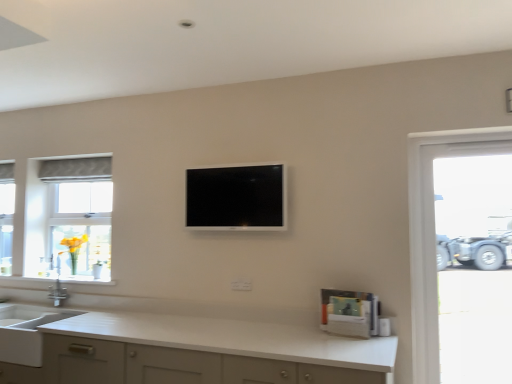
Question: From a real-world perspective, is yellow glass vase at left physically above silver metallic faucet at left?

Choices:
 (A) yes
 (B) no

Answer: (A)

Question: Is yellow glass vase at left bigger than silver metallic faucet at left?

Choices:
 (A) yes
 (B) no

Answer: (A)

Question: Does yellow glass vase at left have a smaller size compared to silver metallic faucet at left?

Choices:
 (A) no
 (B) yes

Answer: (A)

Question: Does yellow glass vase at left have a lesser width compared to silver metallic faucet at left?

Choices:
 (A) no
 (B) yes

Answer: (A)

Question: From the image's perspective, is yellow glass vase at left beneath silver metallic faucet at left?

Choices:
 (A) yes
 (B) no

Answer: (B)

Question: From a real-world perspective, is matte gray fabric at left positioned above or below white matte countertop at lower center?

Choices:
 (A) below
 (B) above

Answer: (B)

Question: In the image, is matte gray fabric at left positioned in front of or behind white matte countertop at lower center?

Choices:
 (A) front
 (B) behind

Answer: (B)

Question: Is matte gray fabric at left wider or thinner than white matte countertop at lower center?

Choices:
 (A) thin
 (B) wide

Answer: (A)

Question: Does point (96, 193) appear closer or farther from the camera than point (40, 297)?

Choices:
 (A) farther
 (B) closer

Answer: (A)

Question: Is matte gray fabric at left wider or thinner than silver metallic faucet at left?

Choices:
 (A) thin
 (B) wide

Answer: (B)

Question: Choose the correct answer: Is matte gray fabric at left inside silver metallic faucet at left or outside it?

Choices:
 (A) inside
 (B) outside

Answer: (B)

Question: Is matte gray fabric at left taller or shorter than silver metallic faucet at left?

Choices:
 (A) short
 (B) tall

Answer: (B)

Question: Considering the positions of matte gray fabric at left and silver metallic faucet at left in the image, is matte gray fabric at left bigger or smaller than silver metallic faucet at left?

Choices:
 (A) small
 (B) big

Answer: (B)

Question: Is yellow glass vase at left taller or shorter than white matte countertop at lower center?

Choices:
 (A) tall
 (B) short

Answer: (B)

Question: From a real-world perspective, is yellow glass vase at left above or below white matte countertop at lower center?

Choices:
 (A) below
 (B) above

Answer: (B)